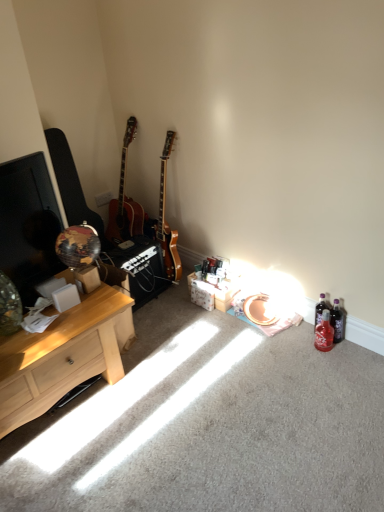
Question: Considering the relative sizes of red glass bottle at lower right, acting as the first bottle starting from the front, and light wood desk at left in the image provided, is red glass bottle at lower right, acting as the first bottle starting from the front, shorter than light wood desk at left?

Choices:
 (A) no
 (B) yes

Answer: (B)

Question: Considering the relative sizes of red glass bottle at lower right, which is the 2th bottle from back to front, and light wood desk at left in the image provided, is red glass bottle at lower right, which is the 2th bottle from back to front, taller than light wood desk at left?

Choices:
 (A) no
 (B) yes

Answer: (A)

Question: Is the depth of red glass bottle at lower right, which is the 2th bottle from back to front, greater than that of light wood desk at left?

Choices:
 (A) no
 (B) yes

Answer: (B)

Question: From a real-world perspective, does red glass bottle at lower right, which is the 2th bottle from back to front, sit lower than light wood desk at left?

Choices:
 (A) yes
 (B) no

Answer: (A)

Question: Is red glass bottle at lower right, which is the 2th bottle from back to front, outside light wood desk at left?

Choices:
 (A) no
 (B) yes

Answer: (B)

Question: Is light wood desk at left in front of or behind translucent plastic bottle at lower right, marked as the first bottle in a back-to-front arrangement, in the image?

Choices:
 (A) behind
 (B) front

Answer: (B)

Question: Is light wood desk at left wider or thinner than translucent plastic bottle at lower right, marked as the first bottle in a back-to-front arrangement?

Choices:
 (A) thin
 (B) wide

Answer: (B)

Question: Would you say light wood desk at left is inside or outside translucent plastic bottle at lower right, marked as the first bottle in a back-to-front arrangement?

Choices:
 (A) outside
 (B) inside

Answer: (A)

Question: In the image, is light wood desk at left on the left side or the right side of translucent plastic bottle at lower right, marked as the first bottle in a back-to-front arrangement?

Choices:
 (A) right
 (B) left

Answer: (B)

Question: Is red glass bottle at lower right, which is the 2th bottle from back to front, in front of or behind translucent plastic bottle at lower right, marked as the first bottle in a back-to-front arrangement, in the image?

Choices:
 (A) front
 (B) behind

Answer: (A)

Question: From a real-world perspective, is red glass bottle at lower right, which is the 2th bottle from back to front, physically located above or below translucent plastic bottle at lower right, marked as the first bottle in a back-to-front arrangement?

Choices:
 (A) above
 (B) below

Answer: (B)

Question: In terms of width, does red glass bottle at lower right, which is the 2th bottle from back to front, look wider or thinner when compared to translucent plastic bottle at lower right, placed as the second bottle when sorted from front to back?

Choices:
 (A) thin
 (B) wide

Answer: (B)

Question: Is point (331, 330) positioned closer to the camera than point (319, 308)?

Choices:
 (A) farther
 (B) closer

Answer: (B)

Question: In the image, is translucent plastic bottle at lower right, placed as the second bottle when sorted from front to back, positioned in front of or behind matte black guitar at left?

Choices:
 (A) front
 (B) behind

Answer: (A)

Question: Is translucent plastic bottle at lower right, placed as the second bottle when sorted from front to back, inside or outside of matte black guitar at left?

Choices:
 (A) outside
 (B) inside

Answer: (A)